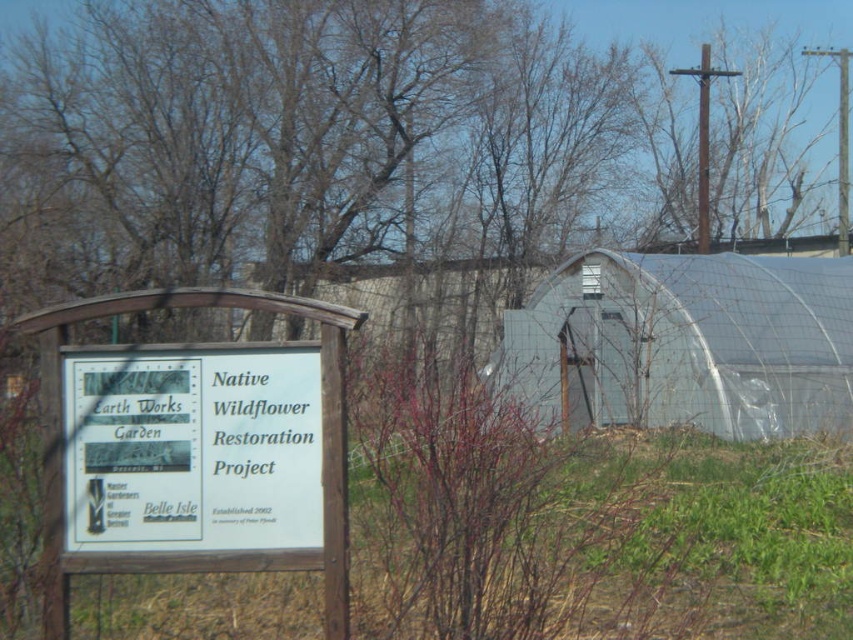
You are standing in front of the greenhouse and notice the bare branches at center and the white wood sign at center. Which object is closer to you?

The bare branches at center are closer to you because they are positioned further to the viewer than the white wood sign at center.

You are a visitor holding a 1.5 meter long measuring tape. You want to measure the distance between the bare branches at center and the white wood sign at center. Can you do this with your measuring tape?

The distance between the bare branches at center and the white wood sign at center is 1.56 meters. Since your measuring tape is 1.5 meters long, it is slightly shorter than the required distance. You might need a longer tape to accurately measure the gap between the bare branches at center and the white wood sign at center.

You are standing in front of the wooden signboard and want to reach the greenhouse in the background. There is a bare branches at center blocking your path. Can you walk around it without getting too close? Explain your reasoning.

The bare branches at center is 6.15 meters away from the viewer. Since the branches are at a distance, you can easily walk around them while maintaining a safe distance from the obstruction.